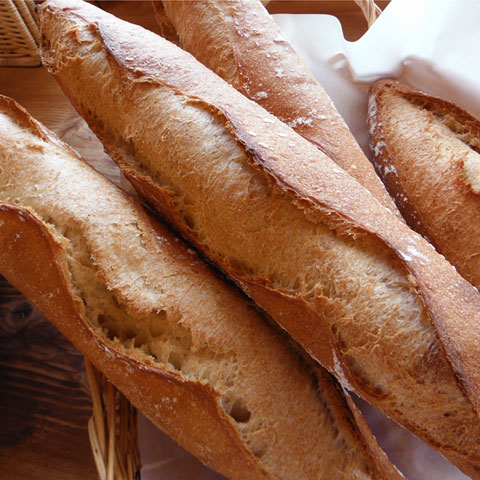
Image resolution: width=480 pixels, height=480 pixels. What are the coordinates of `woven basket` in the screenshot? It's located at (112, 454), (97, 409).